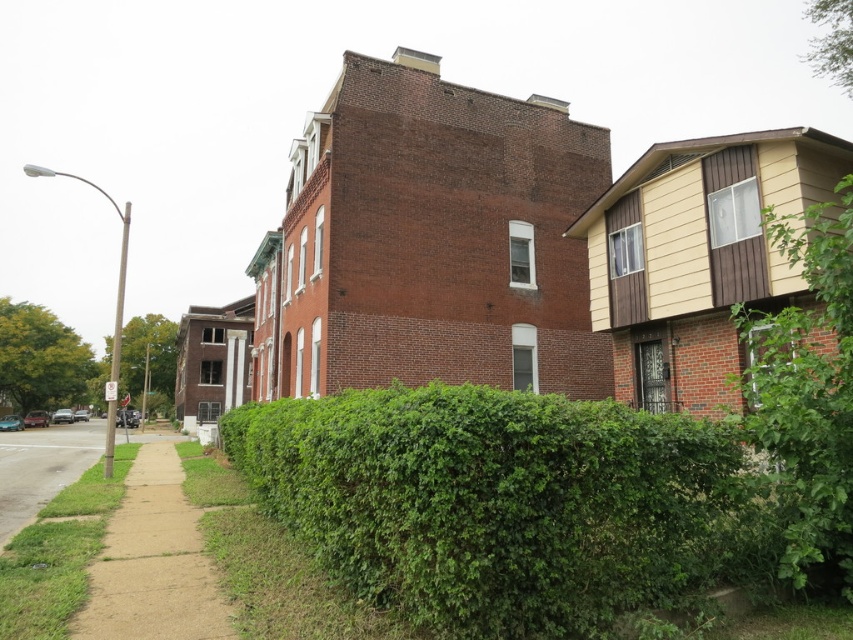
Question: Which object appears farthest from the camera in this image?

Choices:
 (A) green leafy hedge at center
 (B) green leafy bush at lower right

Answer: (B)

Question: Is green leafy hedge at center closer to the viewer compared to brown dirt sidewalk at lower left?

Choices:
 (A) no
 (B) yes

Answer: (B)

Question: Which point is farther to the camera?

Choices:
 (A) green leafy bush at lower right
 (B) brown dirt sidewalk at lower left

Answer: (A)

Question: Can you confirm if green leafy hedge at center is positioned below brown dirt sidewalk at lower left?

Choices:
 (A) yes
 (B) no

Answer: (B)

Question: Which object is farther from the camera taking this photo?

Choices:
 (A) green leafy bush at lower right
 (B) green leafy hedge at center
 (C) brown dirt sidewalk at lower left

Answer: (A)

Question: Does green leafy hedge at center appear over green leafy bush at lower right?

Choices:
 (A) no
 (B) yes

Answer: (A)